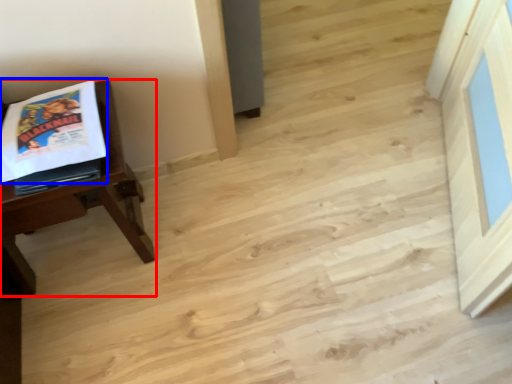
Question: Which point is further to the camera, table (highlighted by a red box) or comic book (highlighted by a blue box)?

Choices:
 (A) table
 (B) comic book

Answer: (B)